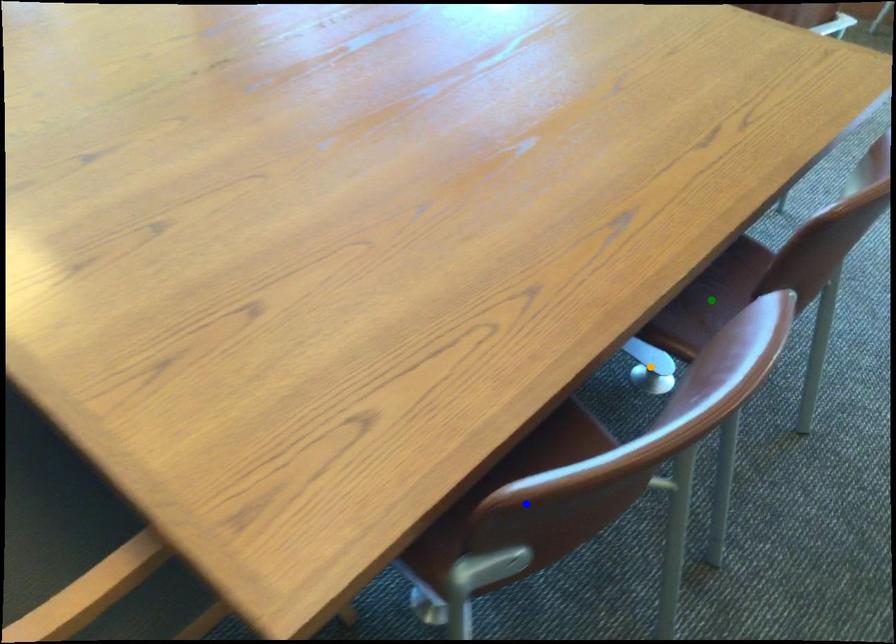
Order these from nearest to farthest:
1. green point
2. blue point
3. orange point

blue point → green point → orange point